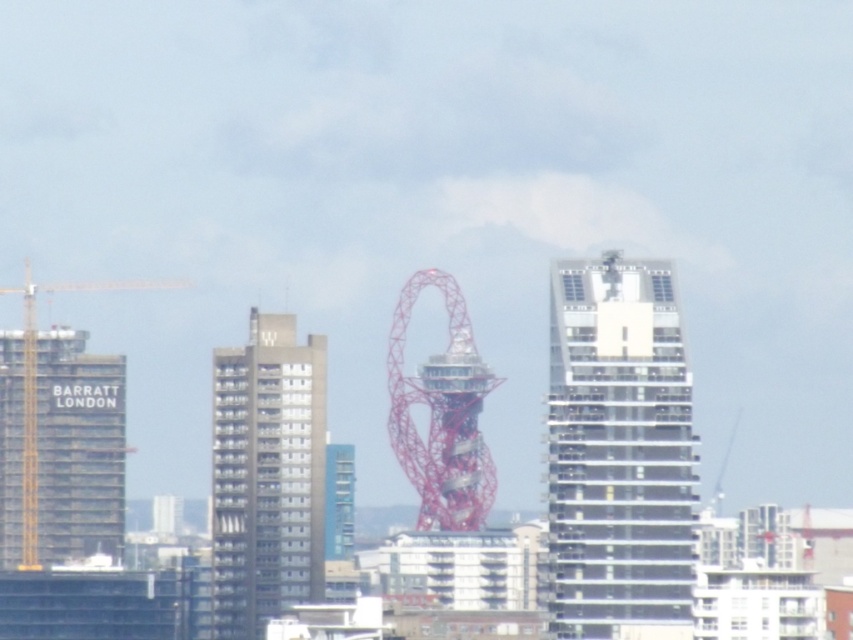
You are navigating a drone through the cityscape scene. You must fly from the point at coordinates point (322, 548) to the point at coordinates point (479, 500). Will you pass in front of or behind the red twisted arch landmark during your flight path?

Since point (322, 548) is behind point (479, 500), the flight path from point (322, 548) to point (479, 500) would require moving towards the front. Therefore, you will pass in front of the red twisted arch landmark during your flight path.

You are a tourist in the city and want to take a photo of both the gray concrete building at center and the metallic red sculpture at center. Since you can only focus on one object at a time, which one should you position closer to the camera to ensure both are in frame?

The gray concrete building at center is positioned on the left side of metallic red sculpture at center, so you should position the metallic red sculpture at center closer to the camera to ensure both are in frame.

You are a drone operator flying over the city. Your drone is currently above the gray concrete building at center and needs to move to the yellow metallic crane at left. Which direction should you fly to avoid obstacles?

The gray concrete building at center is in front of the yellow metallic crane at left, so to reach the crane, you should fly towards the left and behind the gray concrete building to avoid obstacles.